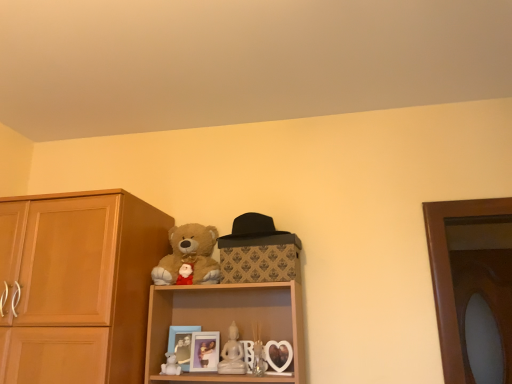
Question: From the image's perspective, is white matte teddy bear at lower center located above white porcelain figurine at center?

Choices:
 (A) yes
 (B) no

Answer: (B)

Question: Can you confirm if white matte teddy bear at lower center is shorter than white porcelain figurine at center?

Choices:
 (A) yes
 (B) no

Answer: (A)

Question: Considering the relative sizes of white matte teddy bear at lower center and white porcelain figurine at center in the image provided, is white matte teddy bear at lower center wider than white porcelain figurine at center?

Choices:
 (A) yes
 (B) no

Answer: (A)

Question: Is there a large distance between white matte teddy bear at lower center and white porcelain figurine at center?

Choices:
 (A) no
 (B) yes

Answer: (A)

Question: Is white matte teddy bear at lower center closer to the viewer compared to white porcelain figurine at center?

Choices:
 (A) no
 (B) yes

Answer: (B)

Question: Is white matte teddy bear at lower center smaller than white porcelain figurine at center?

Choices:
 (A) no
 (B) yes

Answer: (B)

Question: From the image's perspective, is transparent glass door at right on light brown wood cabinet at left?

Choices:
 (A) no
 (B) yes

Answer: (A)

Question: Is light brown wood cabinet at left a part of transparent glass door at right?

Choices:
 (A) no
 (B) yes

Answer: (A)

Question: Is transparent glass door at right wider than light brown wood cabinet at left?

Choices:
 (A) no
 (B) yes

Answer: (A)

Question: Is transparent glass door at right to the left of light brown wood cabinet at left from the viewer's perspective?

Choices:
 (A) yes
 (B) no

Answer: (B)

Question: Does transparent glass door at right come in front of light brown wood cabinet at left?

Choices:
 (A) yes
 (B) no

Answer: (B)

Question: Considering the relative sizes of transparent glass door at right and light brown wood cabinet at left in the image provided, is transparent glass door at right smaller than light brown wood cabinet at left?

Choices:
 (A) yes
 (B) no

Answer: (A)

Question: Can you confirm if transparent glass door at right is positioned to the left of matte blue picture frame at lower center, which appears as the 2th picture frame when viewed from the right?

Choices:
 (A) no
 (B) yes

Answer: (A)